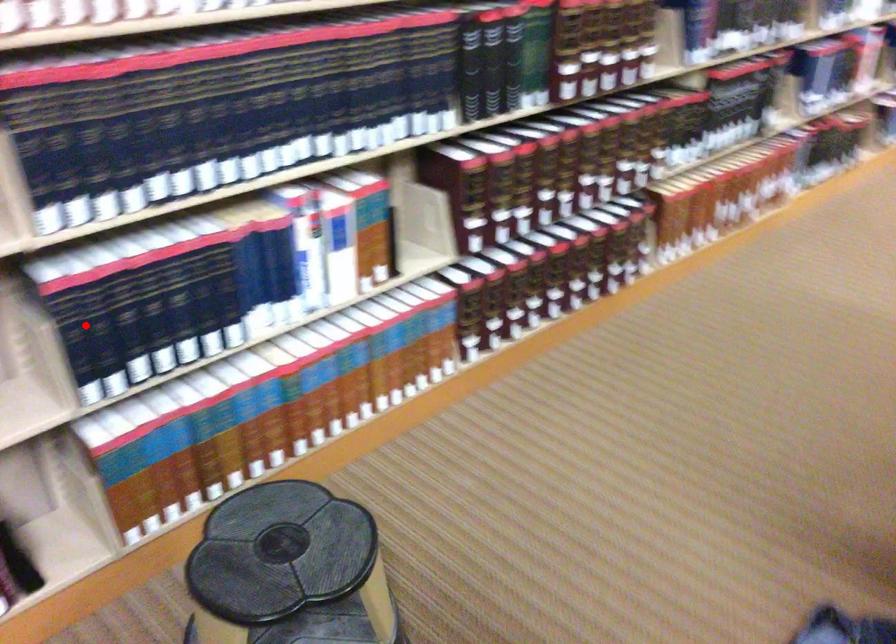
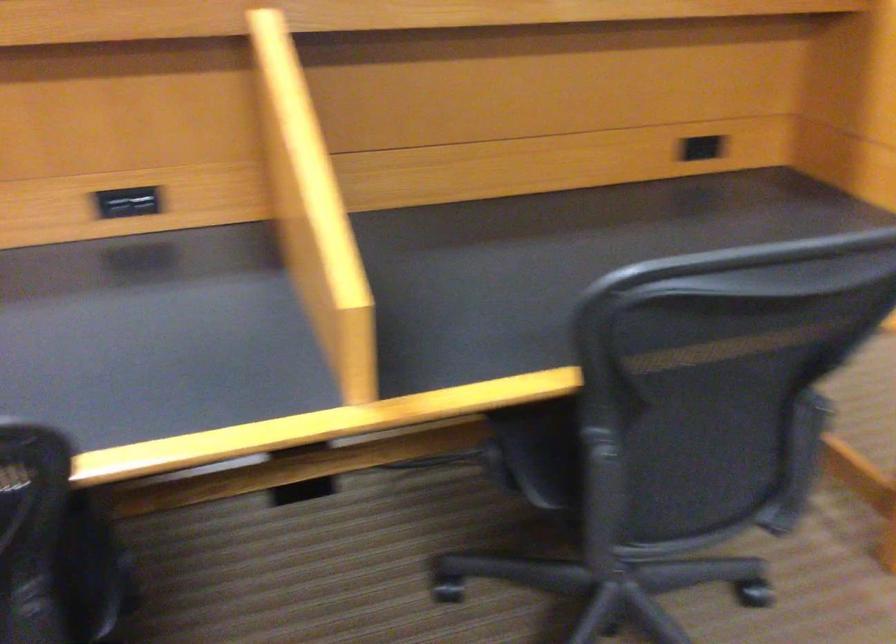
Question: I am providing you with two images of the same scene from different viewpoints. A red point is marked on the first image. Is the red point's position out of view in image 2?

Choices:
 (A) Yes
 (B) No

Answer: (A)